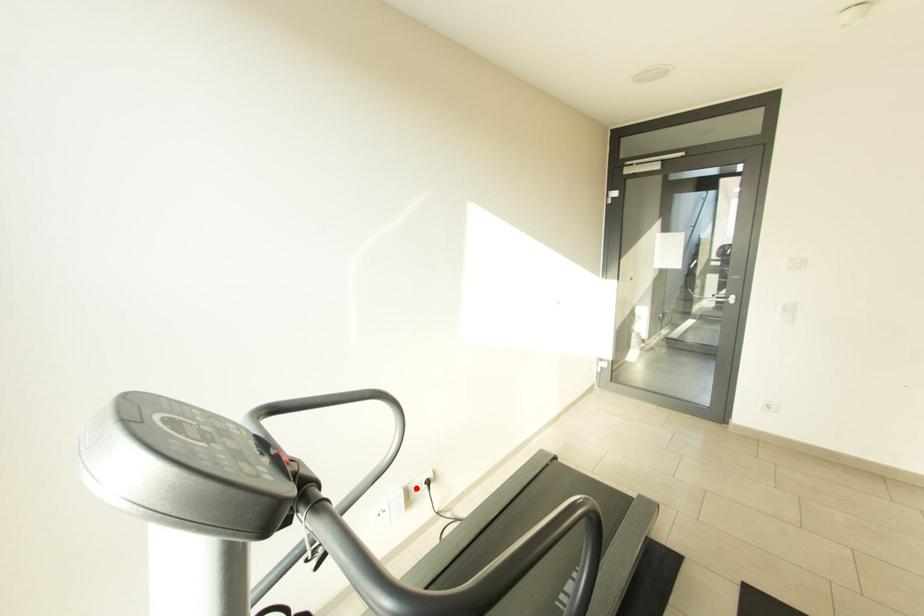
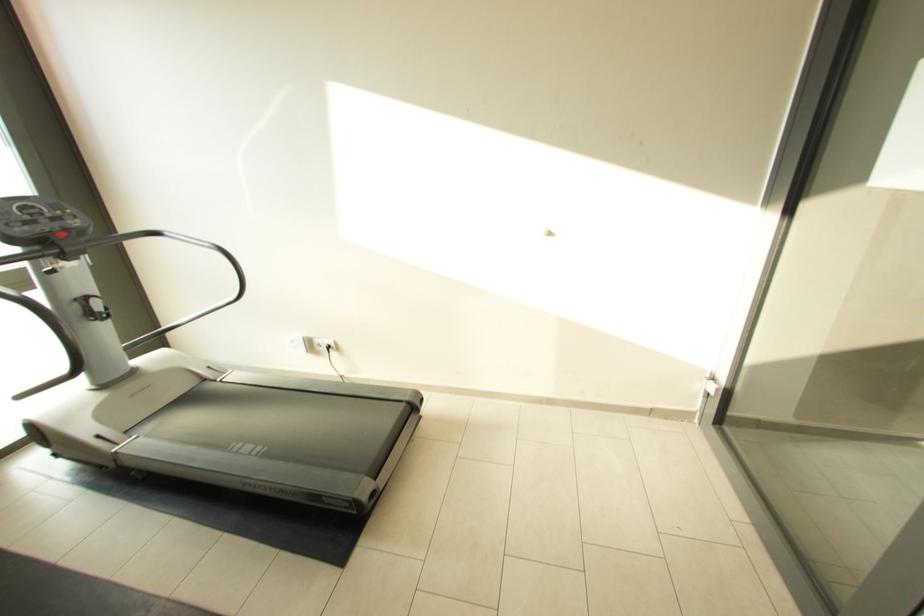
Question: I am providing you with two images of the same scene from different viewpoints. Given a red point in image1, look at the same physical point in image2. Is it:

Choices:
 (A) Closer to the viewpoint
 (B) Farther from the viewpoint

Answer: (A)